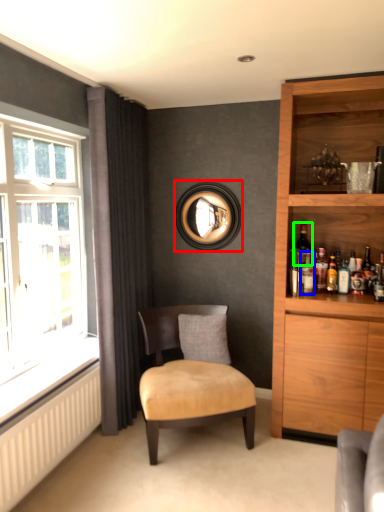
Question: Estimate the real-world distances between objects in this image. Which object is closer to picture frame (highlighted by a red box), bottle (highlighted by a blue box) or wine bottle (highlighted by a green box)?

Choices:
 (A) bottle
 (B) wine bottle

Answer: (A)